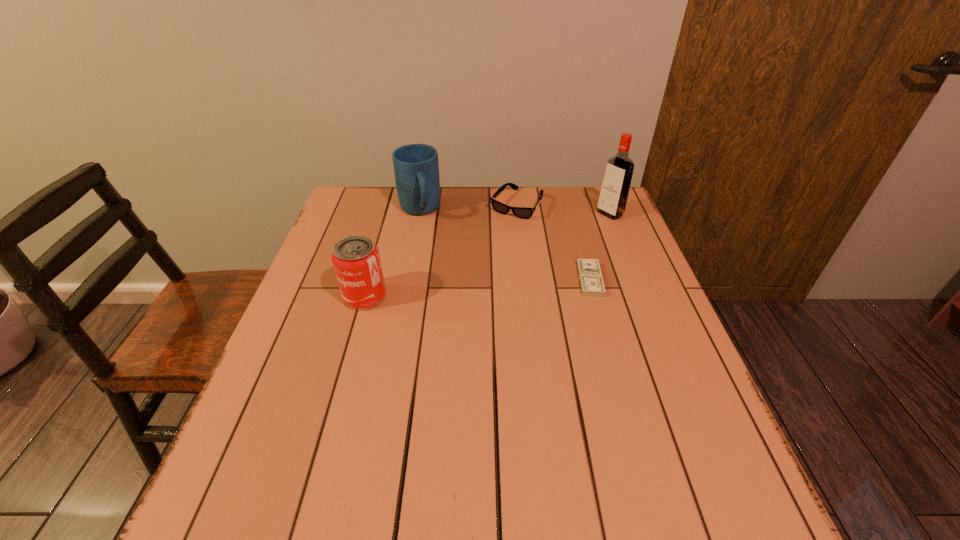
The image size is (960, 540). What are the coordinates of `vodka at the far edge` in the screenshot? It's located at (612, 201).

Locate an element on the screen. This screenshot has width=960, height=540. mug that is at the far edge is located at coordinates (416, 168).

Where is `object present at the left edge`? object present at the left edge is located at coordinates (356, 260).

The width and height of the screenshot is (960, 540). Identify the location of money located in the right edge section of the desktop. (591, 281).

The image size is (960, 540). Identify the location of vodka located in the right edge section of the desktop. (612, 201).

Identify the location of object that is positioned at the far right corner. (612, 201).

In the image, there is a desktop. In order to click on free space at the far edge in this screenshot , I will do `click(507, 190)`.

Image resolution: width=960 pixels, height=540 pixels. What are the coordinates of `vacant space at the near edge` in the screenshot? It's located at (632, 455).

Locate an element on the screen. vacant space at the left edge is located at coordinates (292, 340).

At what (x,y) coordinates should I click in order to perform the action: click on vacant space at the right edge of the desktop. Please return your answer as a coordinate pair (x, y). Image resolution: width=960 pixels, height=540 pixels. Looking at the image, I should click on (616, 299).